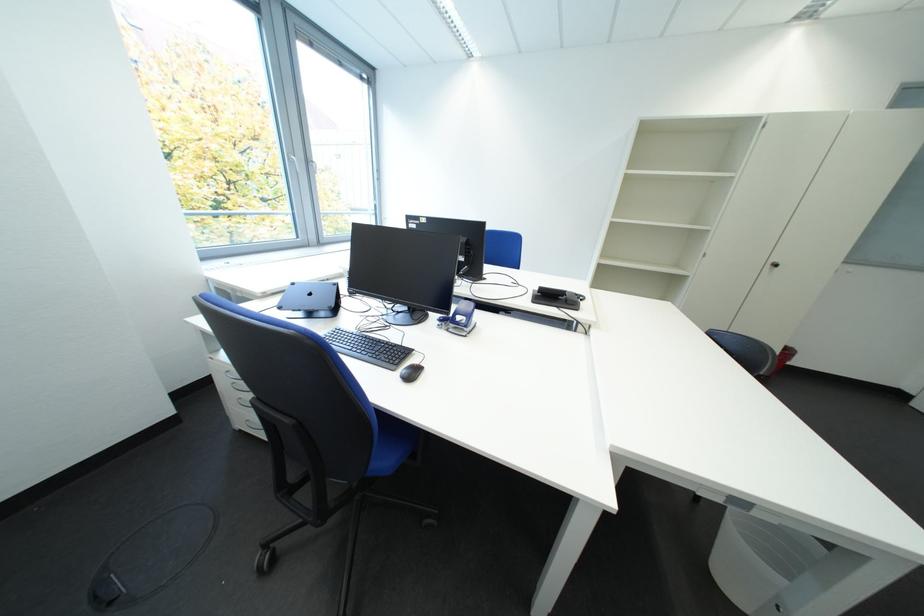
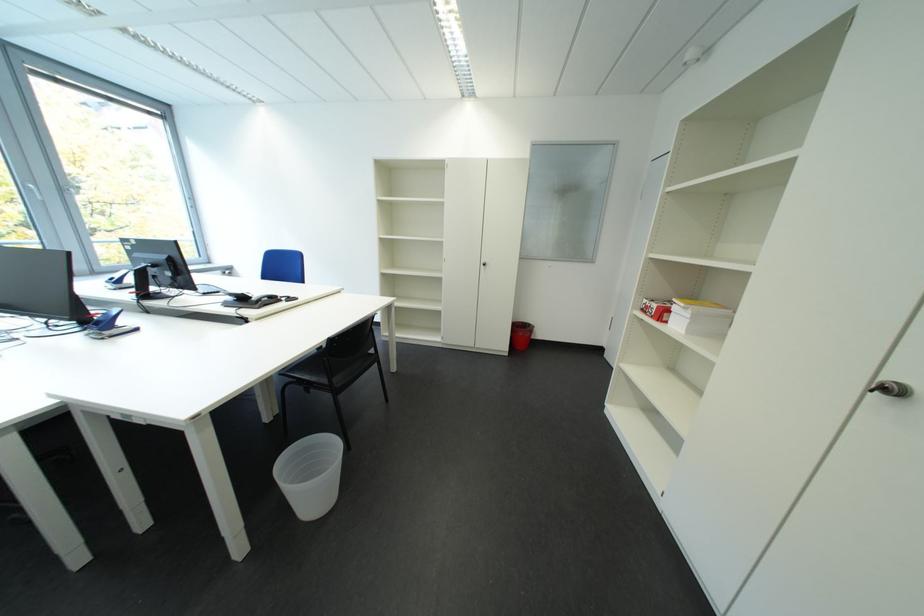
Question: In a continuous first-person perspective shot, in which direction is the camera moving?

Choices:
 (A) Left
 (B) Right
 (C) Forward
 (D) Backward

Answer: (B)